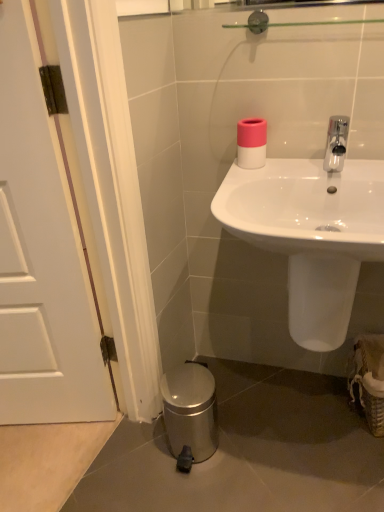
Question: Is polished chrome faucet at upper right inside the boundaries of white glossy sink at center, or outside?

Choices:
 (A) inside
 (B) outside

Answer: (B)

Question: Looking at their shapes, would you say polished chrome faucet at upper right is wider or thinner than white glossy sink at center?

Choices:
 (A) wide
 (B) thin

Answer: (B)

Question: Based on their relative distances, which object is farther from the white glossy sink at center?

Choices:
 (A) woven straw basket at lower right
 (B) pink matte toilet paper at upper center
 (C) white matte door at left
 (D) polished chrome faucet at upper right

Answer: (C)

Question: Estimate the real-world distances between objects in this image. Which object is closer to the white glossy sink at center?

Choices:
 (A) white matte door at left
 (B) polished chrome faucet at upper right
 (C) pink matte toilet paper at upper center
 (D) woven straw basket at lower right

Answer: (B)